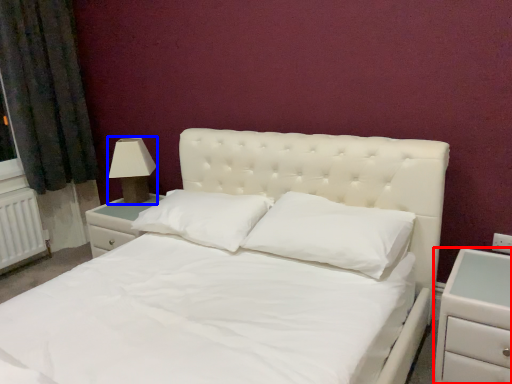
Question: Among these objects, which one is nearest to the camera, nightstand (highlighted by a red box) or lamp (highlighted by a blue box)?

Choices:
 (A) nightstand
 (B) lamp

Answer: (A)